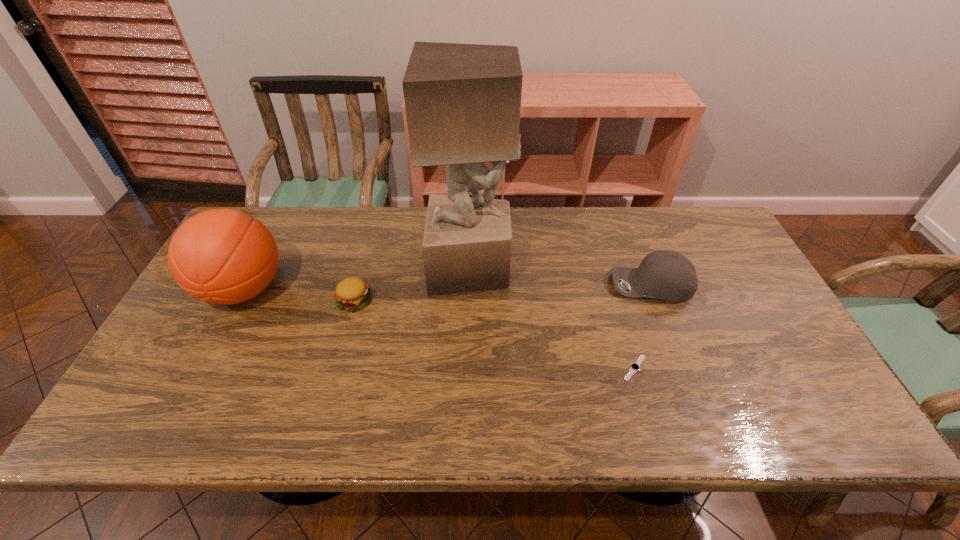
The width and height of the screenshot is (960, 540). Identify the location of blank region between the nearest object and the third tallest object. (643, 327).

You are a GUI agent. You are given a task and a screenshot of the screen. Output one action in this format:
    pyautogui.click(x=<x>, y=<y>)
    Task: Click on the vacant area that lies between the third object from right to left and the fourth tallest object
    The height and width of the screenshot is (540, 960).
    Given the screenshot: What is the action you would take?
    pyautogui.click(x=413, y=285)

Locate an element on the screen. vacant space that's between the shortest object and the fourth shortest object is located at coordinates (440, 329).

Point out which object is positioned as the third nearest to the baseball cap. Please provide its 2D coordinates. Your answer should be formatted as a tuple, i.e. [(x, y)], where the tuple contains the x and y coordinates of a point satisfying the conditions above.

[(352, 294)]

Identify the location of object that can be found as the third closest to the hamburger. Image resolution: width=960 pixels, height=540 pixels. (634, 367).

What are the coordinates of `free point that satisfies the following two spatial constraints: 1. on the front side of the nearest object; 2. on the right side of the basketball` in the screenshot? It's located at (203, 368).

You are a GUI agent. You are given a task and a screenshot of the screen. Output one action in this format:
    pyautogui.click(x=<x>, y=<y>)
    Task: Click on the blank area in the image that satisfies the following two spatial constraints: 1. on the front-facing side of the tallest object; 2. on the front side of the leftmost object
    Image resolution: width=960 pixels, height=540 pixels.
    Given the screenshot: What is the action you would take?
    pyautogui.click(x=470, y=290)

The width and height of the screenshot is (960, 540). Identify the location of free spot that satisfies the following two spatial constraints: 1. on the front side of the nearest object; 2. on the left side of the fourth object from right to left. (337, 368).